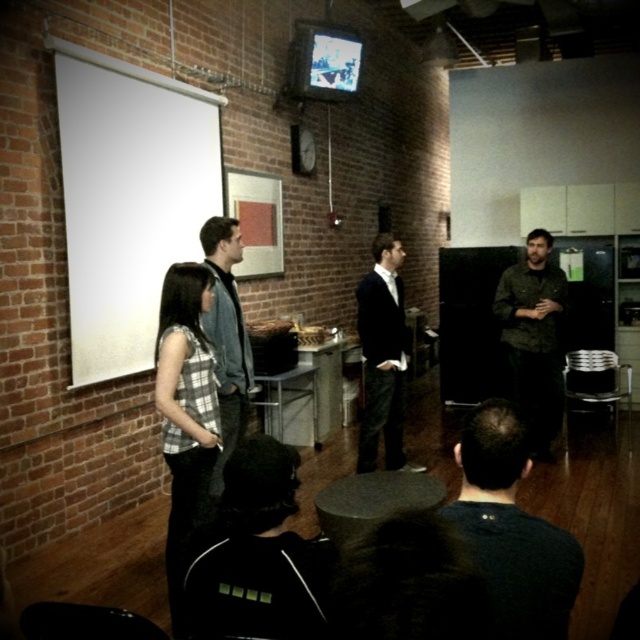
You are organizing a presentation and need to determine seating arrangements based on the attendees clothing. You see the plaid fabric shirt at center and the camouflage jacket at center. Which clothing item belongs to a person who can sit in a narrower chair?

The plaid fabric shirt at center is thinner than the camouflage jacket at center, so the person wearing the plaid fabric shirt at center can sit in a narrower chair since their clothing takes up less space.

You are a photographer at the back of the room and want to take a photo of both the dark gray sweater at lower right and the plaid fabric shirt at center. However, you notice that one of them is shorter than the other. Which one might you need to adjust your camera angle to ensure both are fully visible in the photo?

The dark gray sweater at lower right is not as tall as the plaid fabric shirt at center, so you might need to adjust your camera angle to account for the height difference between the dark gray sweater at lower right and the plaid fabric shirt at center.

You are an attendee at this event and want to greet the person wearing the camouflage jacket at center. Which direction should you move relative to the denim jacket at center?

The camouflage jacket at center is to the right of the denim jacket at center, so you should move to the right side of the denim jacket at center to greet the person wearing the camouflage jacket at center.